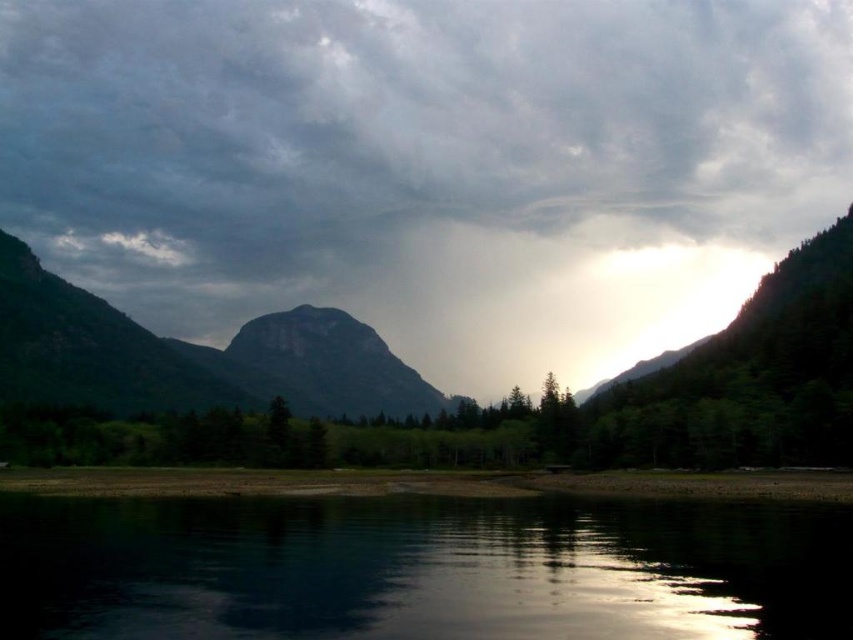
In the scene shown: You are standing at the edge of the water in the serene landscape. You notice a point marked at coordinates point (428, 164). What object does this point correspond to?

The point (428, 164) corresponds to the dark gray cloud at center.

In the scene shown: You are an artist planning to paint the scene. You have two brushes, one large and one small. The large brush is perfect for painting large objects, and the small brush is ideal for smaller details. Based on the scene, which brush should you use for the dark gray cloud at center and which for the black reflective water at lower center?

The dark gray cloud at center is larger in size than the black reflective water at lower center, so use the large brush for the dark gray cloud at center and the small brush for the black reflective water at lower center.